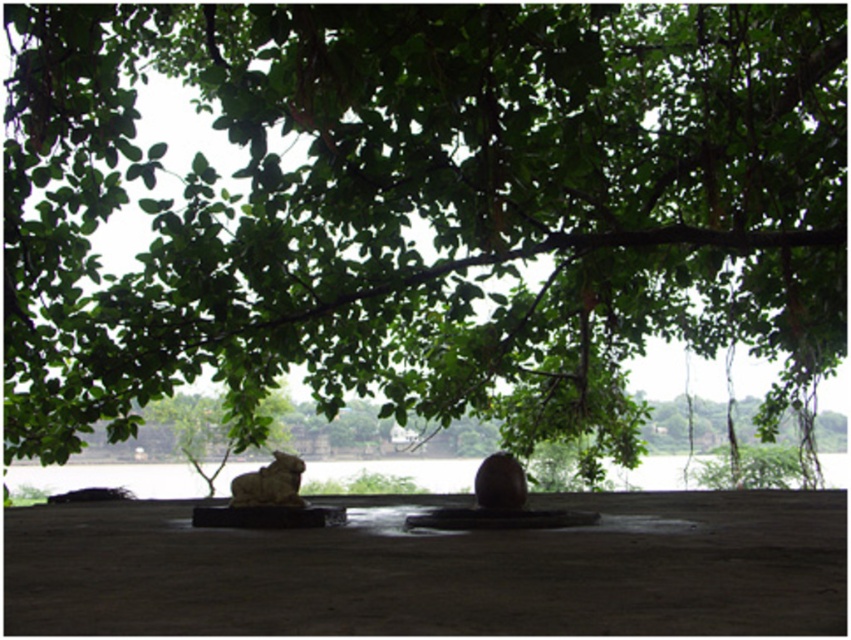
Question: Is clear water at center to the right of matte brown stone at center from the viewer's perspective?

Choices:
 (A) no
 (B) yes

Answer: (A)

Question: Among these objects, which one is farthest from the camera?

Choices:
 (A) matte brown stone at center
 (B) clear water at center

Answer: (B)

Question: Estimate the real-world distances between objects in this image. Which object is closer to the gray stone statue at center?

Choices:
 (A) matte brown stone at center
 (B) clear water at center

Answer: (A)

Question: Observing the image, what is the correct spatial positioning of clear water at center in reference to gray stone statue at center?

Choices:
 (A) above
 (B) below

Answer: (B)

Question: Is clear water at center behind gray stone statue at center?

Choices:
 (A) no
 (B) yes

Answer: (B)

Question: Among these objects, which one is nearest to the camera?

Choices:
 (A) gray stone statue at center
 (B) matte brown stone at center
 (C) clear water at center

Answer: (B)